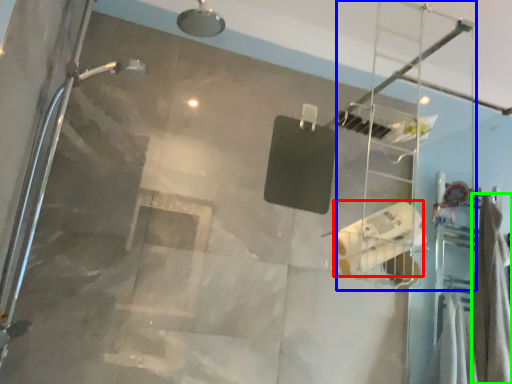
Question: Which is nearer to the toilet paper (highlighted by a red box)? ladder (highlighted by a blue box) or shower curtain (highlighted by a green box).

Choices:
 (A) ladder
 (B) shower curtain

Answer: (B)